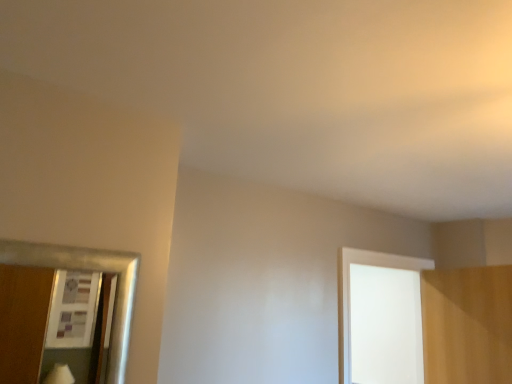
What do you see at coordinates (380, 318) in the screenshot? I see `white matte window at upper right` at bounding box center [380, 318].

The width and height of the screenshot is (512, 384). I want to click on white matte window at upper right, so click(380, 318).

In order to click on white matte window at upper right in this screenshot , I will do `click(380, 318)`.